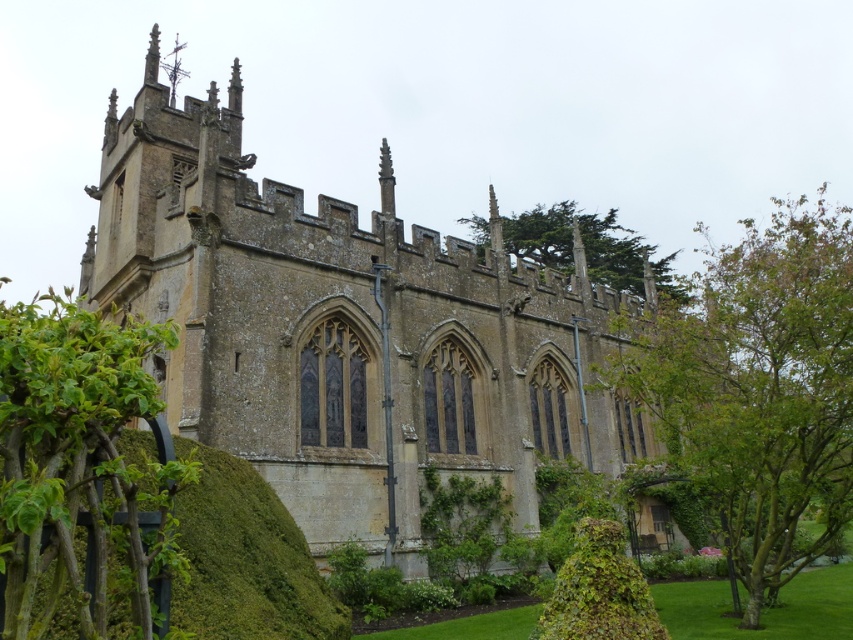
Can you confirm if green leafy tree at right is bigger than green leafy bush at lower left?

Indeed, green leafy tree at right has a larger size compared to green leafy bush at lower left.

Which is in front, point (729, 368) or point (91, 376)?

Positioned in front is point (91, 376).

Where is `green leafy tree at right`? This screenshot has height=640, width=853. green leafy tree at right is located at coordinates (759, 388).

Between yellow stone church at center and green leafy tree at upper center, which one appears on the right side from the viewer's perspective?

green leafy tree at upper center

You are a GUI agent. You are given a task and a screenshot of the screen. Output one action in this format:
    pyautogui.click(x=<x>, y=<y>)
    Task: Click on the yellow stone church at center
    
    Given the screenshot: What is the action you would take?
    pyautogui.click(x=345, y=330)

Where is `yellow stone church at center`? yellow stone church at center is located at coordinates (345, 330).

Does yellow stone church at center appear over green leafy bush at lower left?

Correct, yellow stone church at center is located above green leafy bush at lower left.

Does yellow stone church at center have a greater height compared to green leafy bush at lower left?

Yes.

Identify the location of yellow stone church at center. pyautogui.click(x=345, y=330).